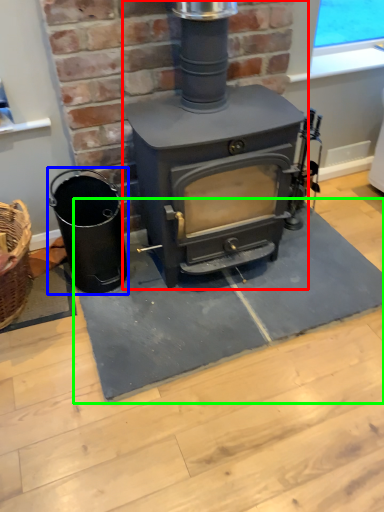
Question: Which object is positioned farthest from wood burning stove (highlighted by a red box)? Select from appliance (highlighted by a blue box) and doormat (highlighted by a green box).

Choices:
 (A) appliance
 (B) doormat

Answer: (B)